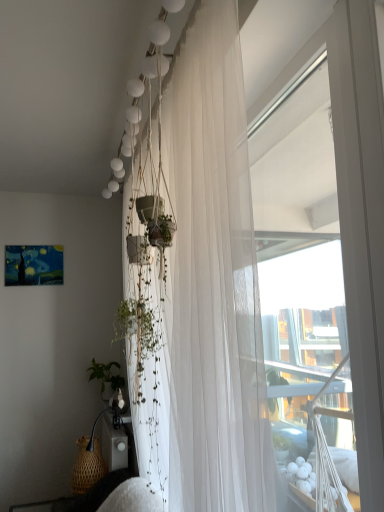
You are a GUI agent. You are given a task and a screenshot of the screen. Output one action in this format:
    pyautogui.click(x=<x>, y=<y>)
    Task: Click on the woven brown basket at lower left
    
    Given the screenshot: What is the action you would take?
    pyautogui.click(x=87, y=465)

The width and height of the screenshot is (384, 512). Describe the element at coordinates (87, 465) in the screenshot. I see `woven brown basket at lower left` at that location.

Measure the distance between point (84, 446) and camera.

2.86 meters.

What do you see at coordinates (213, 281) in the screenshot?
I see `white sheer curtain at upper center` at bounding box center [213, 281].

Identify the location of white sheer curtain at upper center. (213, 281).

Measure the distance between white sheer curtain at upper center and camera.

34.63 inches.

You are a GUI agent. You are given a task and a screenshot of the screen. Output one action in this format:
    pyautogui.click(x=<x>, y=<y>)
    Task: Click on the woven brown basket at lower left
    
    Given the screenshot: What is the action you would take?
    pyautogui.click(x=87, y=465)

Does white sheer curtain at upper center appear on the right side of woven brown basket at lower left?

Correct, you'll find white sheer curtain at upper center to the right of woven brown basket at lower left.

Who is more distant, white sheer curtain at upper center or woven brown basket at lower left?

woven brown basket at lower left is more distant.

Considering the points (223, 389) and (95, 439), which point is behind, point (223, 389) or point (95, 439)?

The point (95, 439) is behind.

From the image's perspective, is white sheer curtain at upper center on top of woven brown basket at lower left?

Indeed, from the image's perspective, white sheer curtain at upper center is shown above woven brown basket at lower left.

From a real-world perspective, who is located higher, white sheer curtain at upper center or woven brown basket at lower left?

white sheer curtain at upper center.

Looking at their sizes, would you say white sheer curtain at upper center is wider or thinner than woven brown basket at lower left?

Clearly, white sheer curtain at upper center has more width compared to woven brown basket at lower left.

Considering the relative sizes of white sheer curtain at upper center and woven brown basket at lower left in the image provided, is white sheer curtain at upper center shorter than woven brown basket at lower left?

No, white sheer curtain at upper center is not shorter than woven brown basket at lower left.

Can you confirm if white sheer curtain at upper center is smaller than woven brown basket at lower left?

No, white sheer curtain at upper center is not smaller than woven brown basket at lower left.

Is white sheer curtain at upper center located outside woven brown basket at lower left?

Yes, white sheer curtain at upper center is located beyond the bounds of woven brown basket at lower left.

Is white sheer curtain at upper center in contact with woven brown basket at lower left?

white sheer curtain at upper center and woven brown basket at lower left are clearly separated.

Is white sheer curtain at upper center aimed at woven brown basket at lower left?

No, white sheer curtain at upper center is not turned towards woven brown basket at lower left.

How many degrees apart are the facing directions of white sheer curtain at upper center and woven brown basket at lower left?

They differ by 3.96 degrees in their facing directions.

Consider the image. Measure the distance between white sheer curtain at upper center and woven brown basket at lower left.

They are 1.88 meters apart.

Image resolution: width=384 pixels, height=512 pixels. I want to click on basket below the white sheer curtain at upper center (from a real-world perspective), so click(x=87, y=465).

Considering the relative positions of woven brown basket at lower left and white sheer curtain at upper center in the image provided, is woven brown basket at lower left to the left or to the right of white sheer curtain at upper center?

From the image, it's evident that woven brown basket at lower left is to the left of white sheer curtain at upper center.

Does woven brown basket at lower left lie behind white sheer curtain at upper center?

Yes, woven brown basket at lower left is behind white sheer curtain at upper center.

Between point (94, 473) and point (234, 109), which one is positioned in front?

Positioned in front is point (234, 109).

From the image's perspective, is woven brown basket at lower left above or below white sheer curtain at upper center?

Clearly, from the image's perspective, woven brown basket at lower left is below white sheer curtain at upper center.

From a real-world perspective, is woven brown basket at lower left under white sheer curtain at upper center?

Yes, from a real-world perspective, woven brown basket at lower left is below white sheer curtain at upper center.

Does woven brown basket at lower left have a greater width compared to white sheer curtain at upper center?

Incorrect, the width of woven brown basket at lower left does not surpass that of white sheer curtain at upper center.

Can you confirm if woven brown basket at lower left is shorter than white sheer curtain at upper center?

Yes, woven brown basket at lower left is shorter than white sheer curtain at upper center.

Does woven brown basket at lower left have a smaller size compared to white sheer curtain at upper center?

Yes, woven brown basket at lower left is smaller than white sheer curtain at upper center.

Is woven brown basket at lower left completely or partially outside of white sheer curtain at upper center?

Absolutely, woven brown basket at lower left is external to white sheer curtain at upper center.

Are woven brown basket at lower left and white sheer curtain at upper center located far from each other?

woven brown basket at lower left is positioned a significant distance from white sheer curtain at upper center.

Could you tell me if woven brown basket at lower left is turned towards white sheer curtain at upper center?

No, woven brown basket at lower left does not turn towards white sheer curtain at upper center.

Identify the location of curtain above the woven brown basket at lower left (from the image's perspective). (213, 281).

Image resolution: width=384 pixels, height=512 pixels. What are the coordinates of `basket below the white sheer curtain at upper center (from a real-world perspective)` in the screenshot? It's located at (87, 465).

Locate an element on the screen. This screenshot has width=384, height=512. curtain that appears in front of the woven brown basket at lower left is located at coordinates (213, 281).